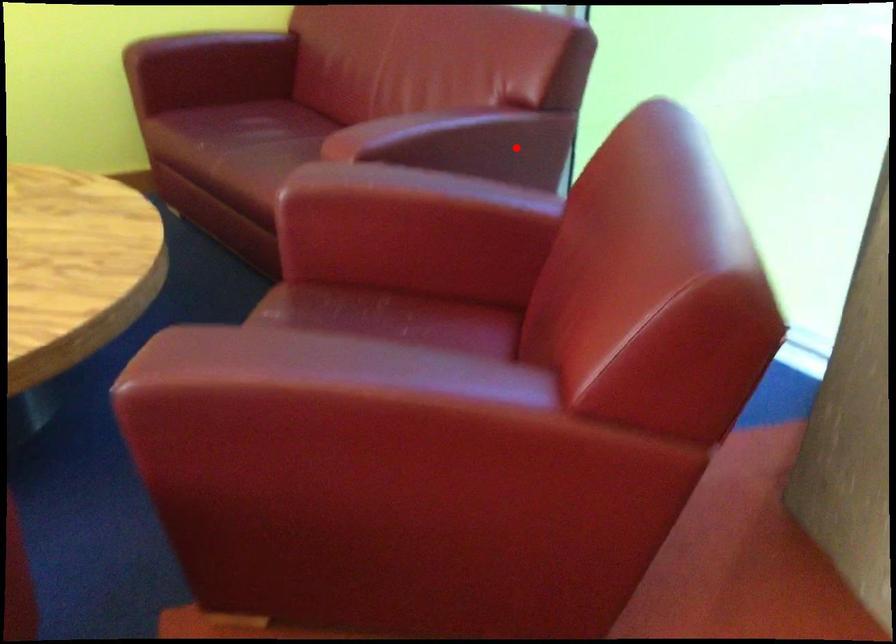
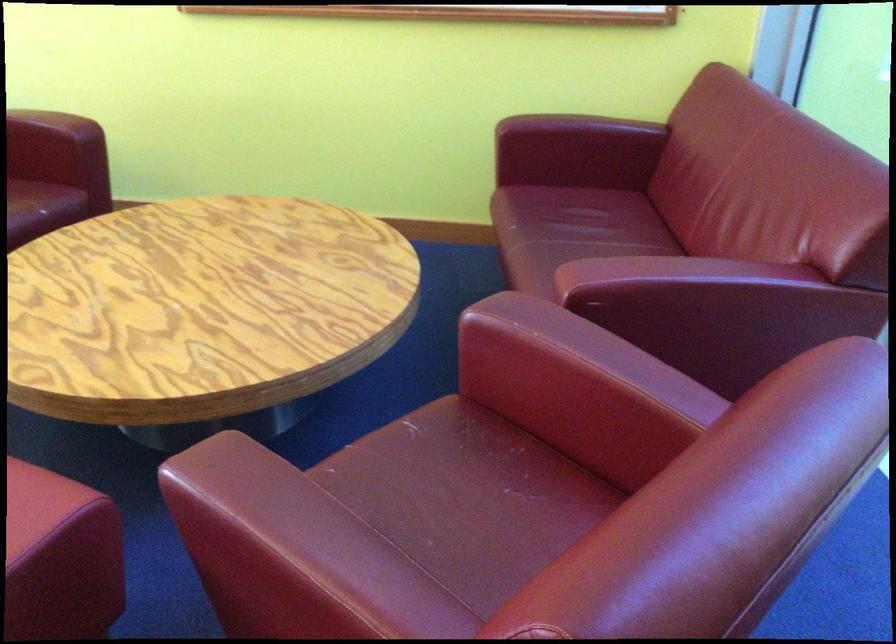
In the second image, find the point that corresponds to the highlighted location in the first image.

(787, 323)